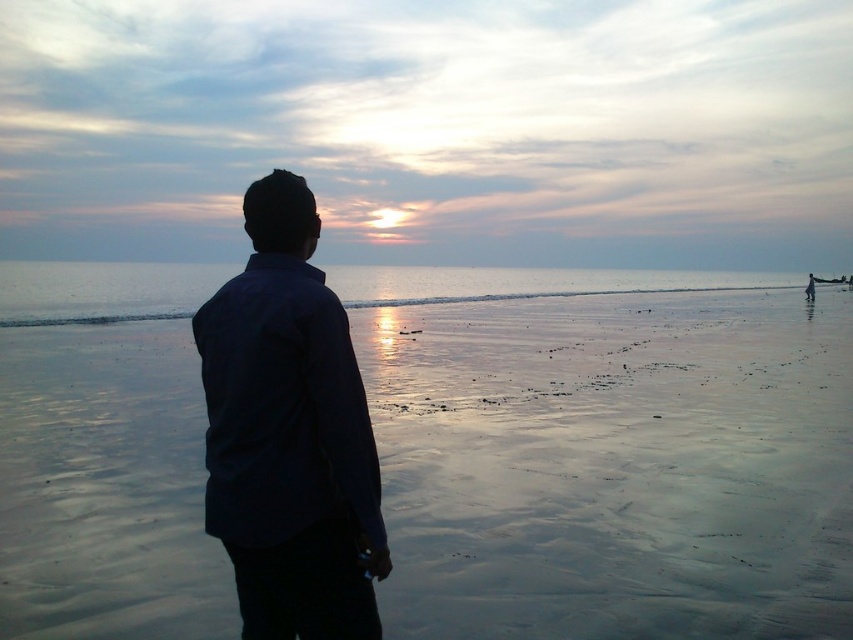
Question: Which object appears closest to the camera in this image?

Choices:
 (A) glistening silver water at center
 (B) smooth sand at center
 (C) dark blue shirt at center

Answer: (C)

Question: Which point is farther from the camera taking this photo?

Choices:
 (A) (386, 291)
 (B) (561, 316)

Answer: (A)

Question: Is dark blue shirt at center smaller than glistening silver water at center?

Choices:
 (A) no
 (B) yes

Answer: (B)

Question: Which point is closer to the camera taking this photo?

Choices:
 (A) (387, 301)
 (B) (773, 572)
 (C) (314, 531)

Answer: (C)

Question: Does dark blue shirt at center appear on the right side of glistening silver water at center?

Choices:
 (A) no
 (B) yes

Answer: (B)

Question: Considering the relative positions of smooth sand at center and glistening silver water at center in the image provided, where is smooth sand at center located with respect to glistening silver water at center?

Choices:
 (A) above
 (B) below

Answer: (B)